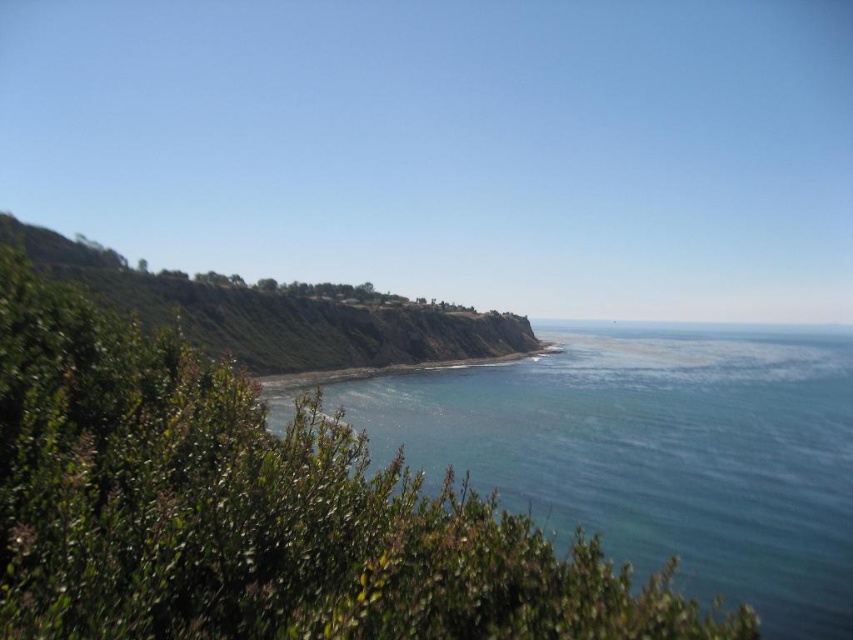
Question: Which point is farther from the camera taking this photo?

Choices:
 (A) (260, 384)
 (B) (68, 420)

Answer: (A)

Question: Which object is closer to the camera taking this photo?

Choices:
 (A) green leafy shrubs at center
 (B) blue smooth water at center
 (C) green grassy shoreline at center
 (D) green grassy hillside at left

Answer: (A)

Question: Does green leafy shrubs at center have a larger size compared to green grassy hillside at left?

Choices:
 (A) yes
 (B) no

Answer: (B)

Question: Does green grassy hillside at left appear over green grassy shoreline at center?

Choices:
 (A) no
 (B) yes

Answer: (B)

Question: Is green grassy hillside at left thinner than green grassy shoreline at center?

Choices:
 (A) yes
 (B) no

Answer: (B)

Question: Which object is farther from the camera taking this photo?

Choices:
 (A) green grassy shoreline at center
 (B) green leafy shrubs at center

Answer: (A)